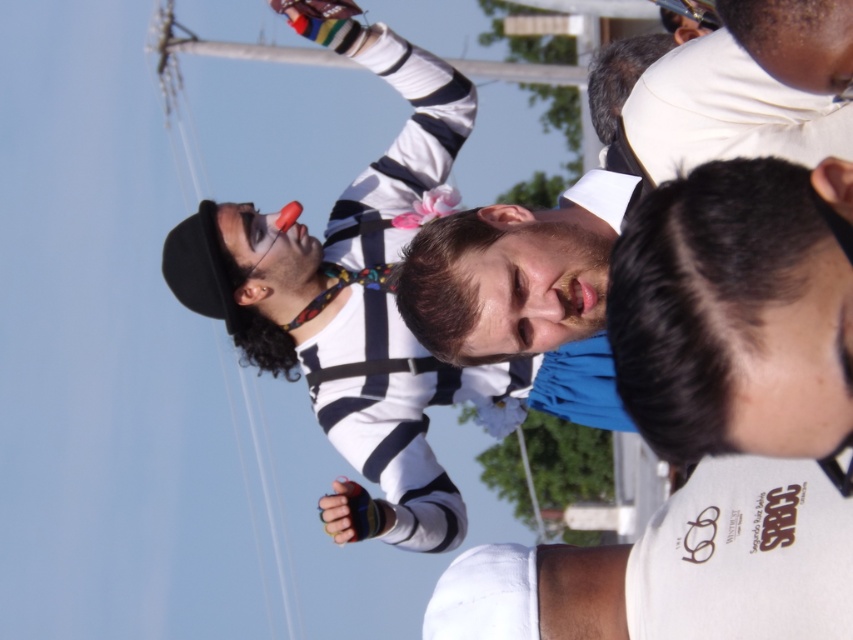
Does matte striped shirt at left have a larger size compared to white striped pole at upper center?

Yes.

Who is higher up, matte striped shirt at left or white striped pole at upper center?

white striped pole at upper center is higher up.

Is point (383, 321) less distant than point (202, 49)?

Yes.

Where is `matte striped shirt at left`? The width and height of the screenshot is (853, 640). matte striped shirt at left is located at coordinates (355, 304).